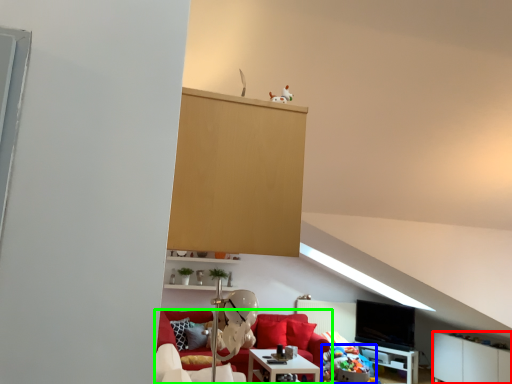
Question: Which is nearer to the cabinetry (highlighted by a red box)? stuff (highlighted by a blue box) or studio couch (highlighted by a green box).

Choices:
 (A) stuff
 (B) studio couch

Answer: (A)